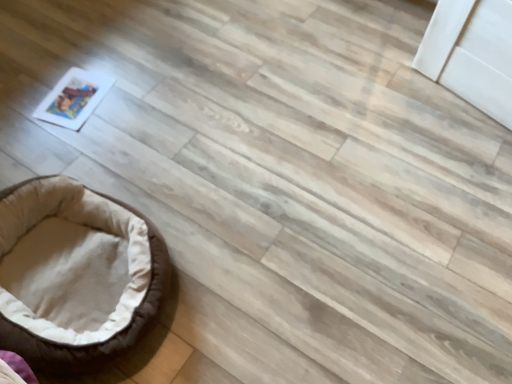
Image resolution: width=512 pixels, height=384 pixels. Identify the location of brown fabric dog bed at lower left. (99, 231).

In order to face brown fabric dog bed at lower left, should I rotate leftwards or rightwards?

It's best to rotate left around 24.296 degrees.

Describe the element at coordinates (99, 231) in the screenshot. I see `brown fabric dog bed at lower left` at that location.

You are a GUI agent. You are given a task and a screenshot of the screen. Output one action in this format:
    pyautogui.click(x=<x>, y=<y>)
    Task: Click on the brown fabric dog bed at lower left
    This screenshot has width=512, height=384.
    Given the screenshot: What is the action you would take?
    pyautogui.click(x=99, y=231)